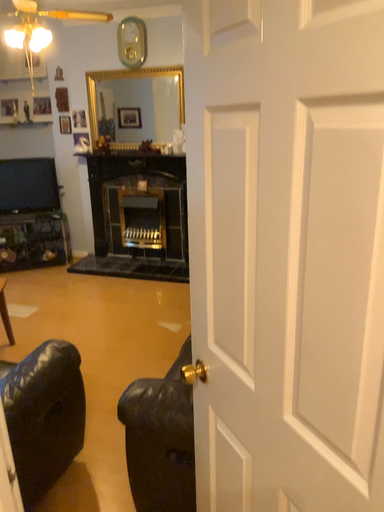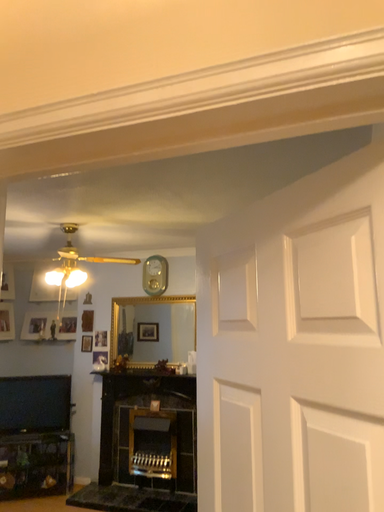
Question: How did the camera likely rotate when shooting the video?

Choices:
 (A) rotated upward
 (B) rotated downward

Answer: (A)